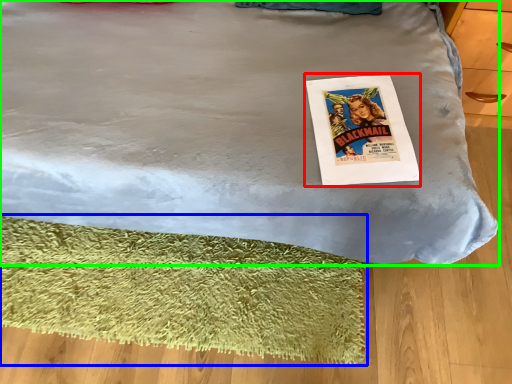
Question: Estimate the real-world distances between objects in this image. Which object is closer to magazine (highlighted by a red box), mat (highlighted by a blue box) or bed (highlighted by a green box)?

Choices:
 (A) mat
 (B) bed

Answer: (B)